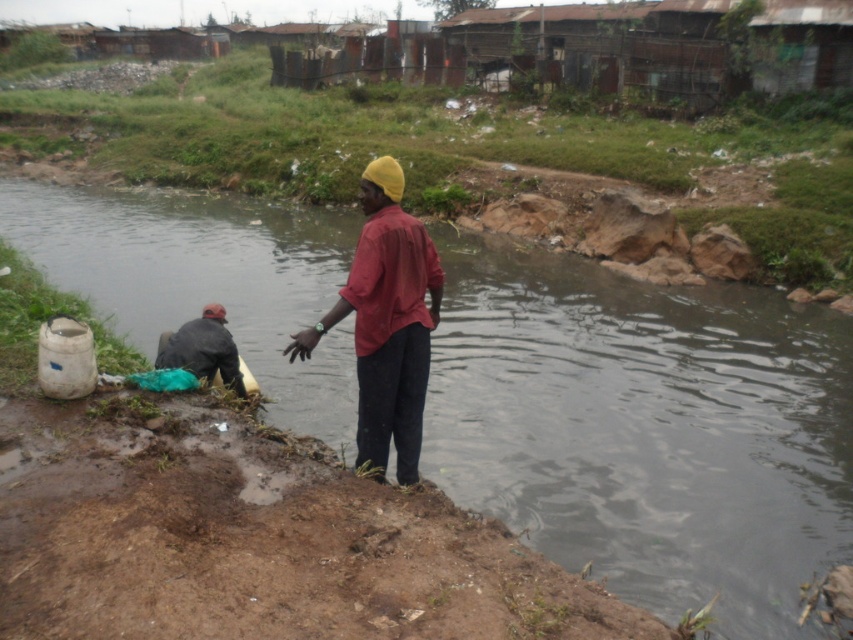
Does brown muddy stream at center appear on the right side of dark gray fabric at lower left?

Indeed, brown muddy stream at center is positioned on the right side of dark gray fabric at lower left.

Measure the distance between point (236, 307) and camera.

10.45 meters

Is point (254, 317) less distant than point (173, 332)?

No.

Where is `brown muddy stream at center`? The height and width of the screenshot is (640, 853). brown muddy stream at center is located at coordinates (646, 428).

Is matte red shirt at center closer to camera compared to dark gray fabric at lower left?

Yes, it is.

Between point (357, 410) and point (212, 348), which one is positioned in front?

Point (212, 348) is in front.

At what (x,y) coordinates should I click in order to perform the action: click on matte red shirt at center. Please return your answer as a coordinate pair (x, y). The width and height of the screenshot is (853, 640). Looking at the image, I should click on (386, 321).

Does brown muddy stream at center have a greater width compared to matte red shirt at center?

Yes.

Where is `brown muddy stream at center`? Image resolution: width=853 pixels, height=640 pixels. brown muddy stream at center is located at coordinates (646, 428).

Who is more forward, [606,518] or [416,392]?

Point [416,392] is in front.

Find the location of a particular element. The height and width of the screenshot is (640, 853). brown muddy stream at center is located at coordinates (646, 428).